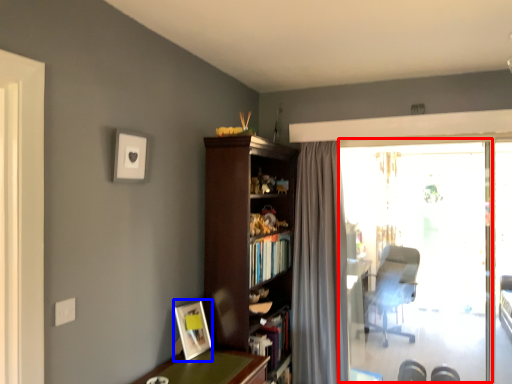
Question: Which of the following is the farthest to the observer, window screen (highlighted by a red box) or picture frame (highlighted by a blue box)?

Choices:
 (A) window screen
 (B) picture frame

Answer: (A)